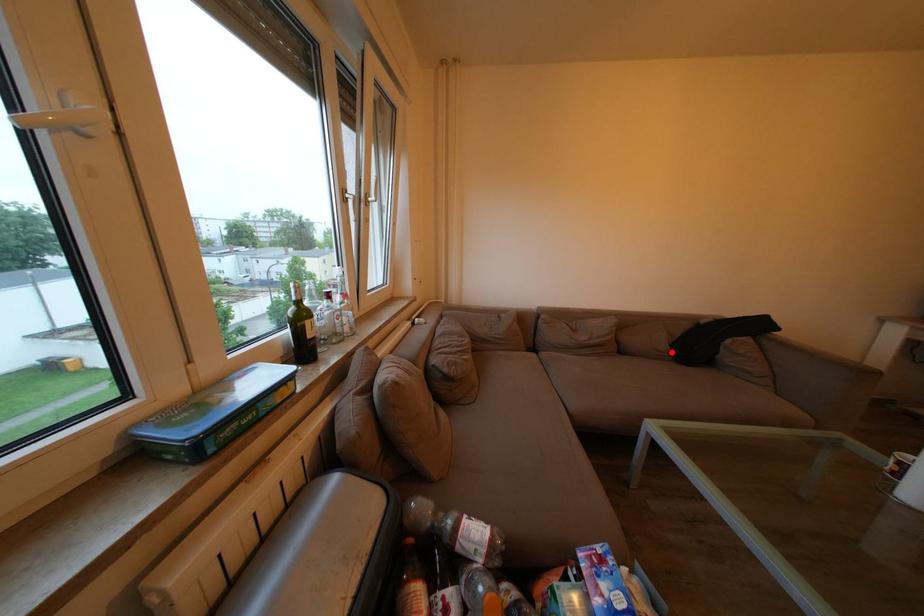
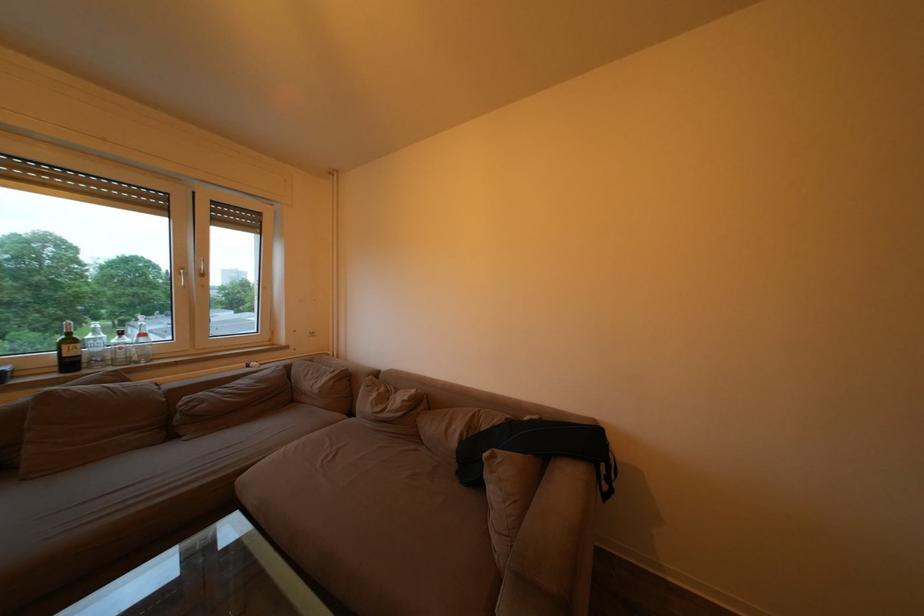
Question: I am providing you with two images of the same scene from different viewpoints. A red point is marked on the first image. Can you still see the location of the red point in image 2?

Choices:
 (A) Yes
 (B) No

Answer: (A)